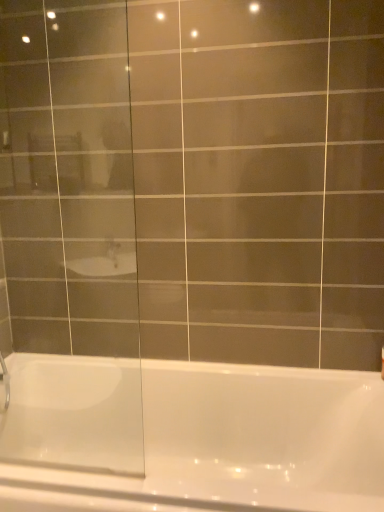
Where is `white glossy bathtub at lower center`? This screenshot has height=512, width=384. white glossy bathtub at lower center is located at coordinates (197, 431).

The image size is (384, 512). Describe the element at coordinates (197, 431) in the screenshot. I see `white glossy bathtub at lower center` at that location.

The height and width of the screenshot is (512, 384). What are the coordinates of `white glossy bathtub at lower center` in the screenshot? It's located at (197, 431).